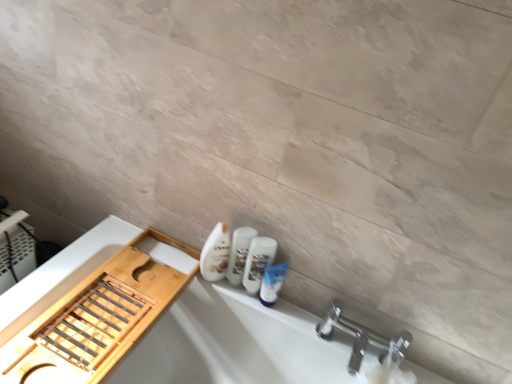
Question: Can you confirm if chrome metallic faucet at lower right is shorter than white glossy mouthwash at lower right, which is counted as the 1th mouthwash, starting from the right?

Choices:
 (A) yes
 (B) no

Answer: (A)

Question: Does chrome metallic faucet at lower right contain white glossy mouthwash at lower right, which appears as the 2th mouthwash when viewed from the left?

Choices:
 (A) no
 (B) yes

Answer: (A)

Question: From a real-world perspective, is chrome metallic faucet at lower right located beneath white glossy mouthwash at lower right, which appears as the 2th mouthwash when viewed from the left?

Choices:
 (A) yes
 (B) no

Answer: (A)

Question: Considering the relative sizes of chrome metallic faucet at lower right and white glossy mouthwash at lower right, which appears as the 2th mouthwash when viewed from the left, in the image provided, is chrome metallic faucet at lower right smaller than white glossy mouthwash at lower right, which appears as the 2th mouthwash when viewed from the left,?

Choices:
 (A) yes
 (B) no

Answer: (B)

Question: From the image's perspective, does chrome metallic faucet at lower right appear lower than white glossy mouthwash at lower right, which is counted as the 1th mouthwash, starting from the right?

Choices:
 (A) yes
 (B) no

Answer: (A)

Question: Is chrome metallic faucet at lower right bigger than white glossy mouthwash at lower right, which is counted as the 1th mouthwash, starting from the right?

Choices:
 (A) yes
 (B) no

Answer: (A)

Question: Is the surface of white glossy mouthwash at lower center, which is the 1th mouthwash from left to right, in direct contact with chrome metallic faucet at lower right?

Choices:
 (A) yes
 (B) no

Answer: (B)

Question: From a real-world perspective, is white glossy mouthwash at lower center, positioned as the second mouthwash in right-to-left order, located higher than chrome metallic faucet at lower right?

Choices:
 (A) no
 (B) yes

Answer: (B)

Question: Is white glossy mouthwash at lower center, which is the 1th mouthwash from left to right, far from chrome metallic faucet at lower right?

Choices:
 (A) no
 (B) yes

Answer: (A)

Question: Does white glossy mouthwash at lower center, positioned as the second mouthwash in right-to-left order, have a larger size compared to chrome metallic faucet at lower right?

Choices:
 (A) yes
 (B) no

Answer: (B)

Question: Can you confirm if white glossy mouthwash at lower center, which is the 1th mouthwash from left to right, is wider than chrome metallic faucet at lower right?

Choices:
 (A) yes
 (B) no

Answer: (B)

Question: Does white glossy mouthwash at lower center, which is the 1th mouthwash from left to right, contain chrome metallic faucet at lower right?

Choices:
 (A) no
 (B) yes

Answer: (A)

Question: Is chrome metallic faucet at lower right not inside white matte bathtub at lower left?

Choices:
 (A) no
 (B) yes

Answer: (B)